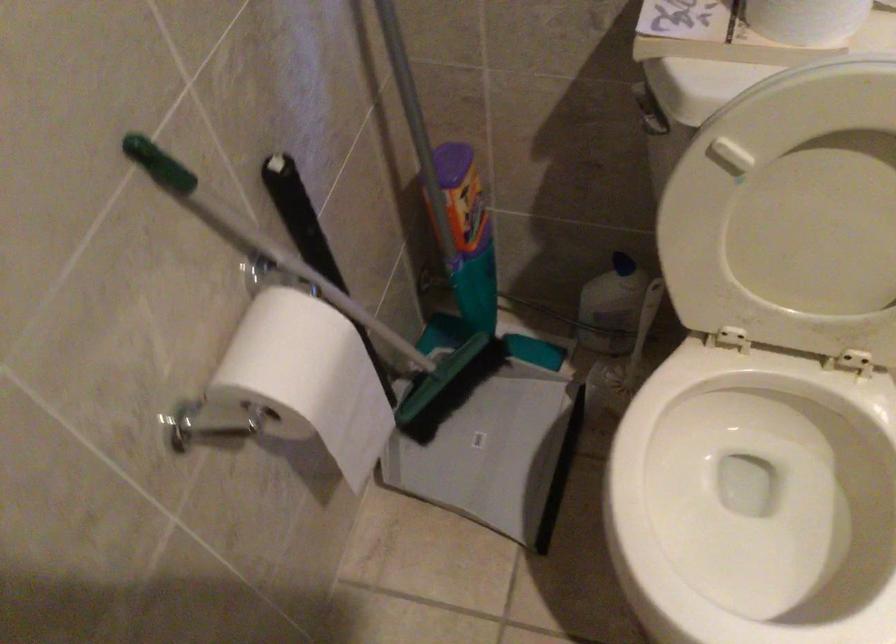
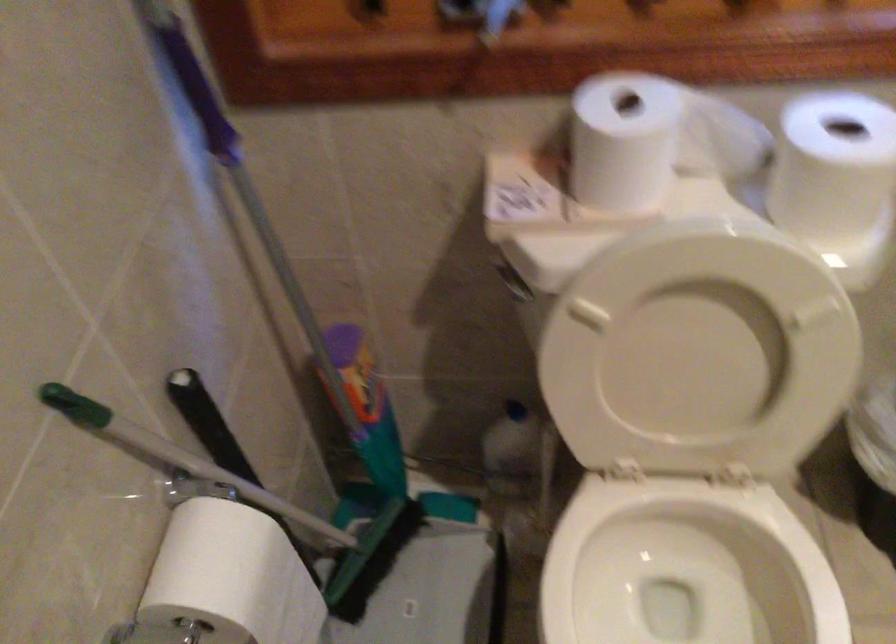
In the second image, find the point that corresponds to [497,415] in the first image.

(424, 576)